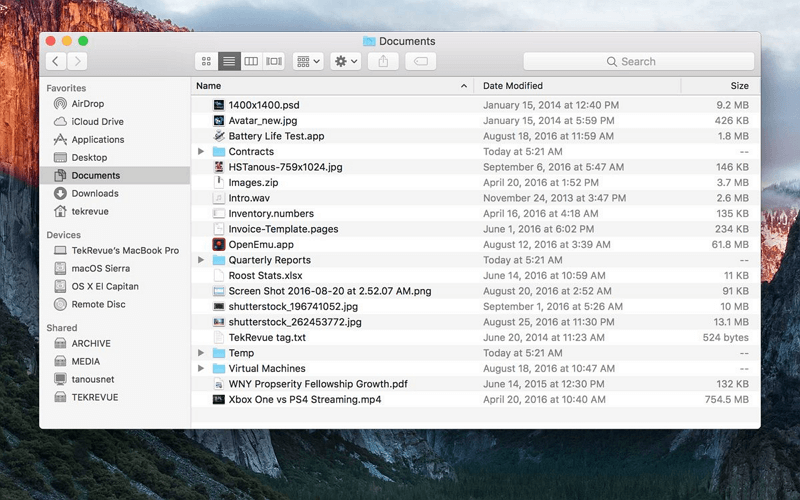
You are a GUI agent. You are given a task and a screenshot of the screen. Output one action in this format:
    pyautogui.click(x=<x>, y=<y>)
    Task: Click on the devices
    The width and height of the screenshot is (800, 500).
    Given the screenshot: What is the action you would take?
    pyautogui.click(x=112, y=249), pyautogui.click(x=108, y=268), pyautogui.click(x=108, y=283), pyautogui.click(x=108, y=299)